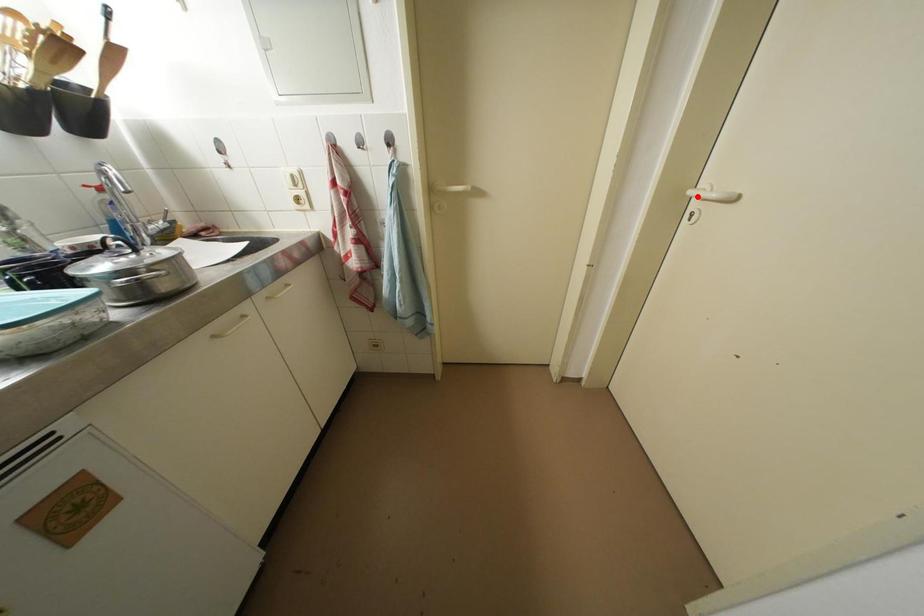
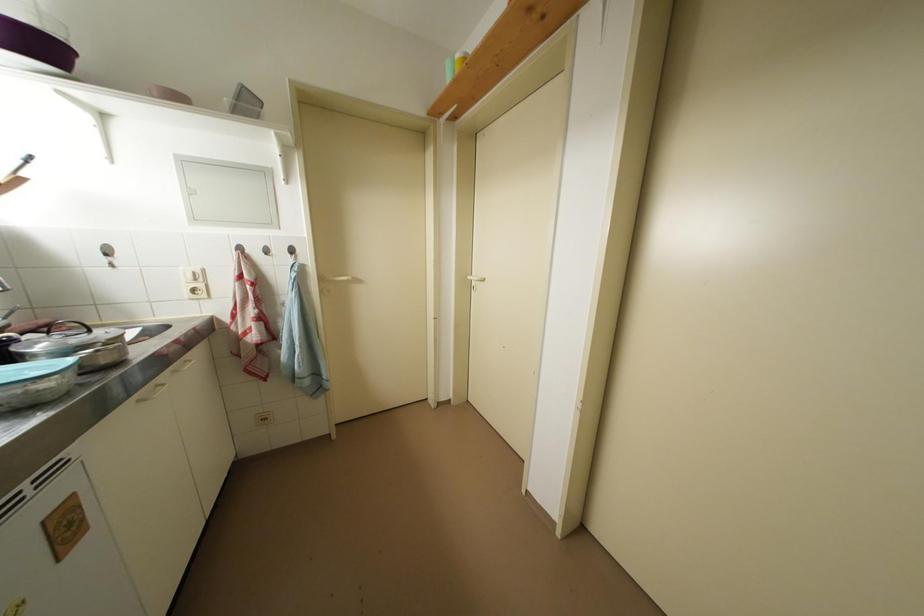
The point at the highlighted location is marked in the first image. Where is the corresponding point in the second image?

(476, 282)